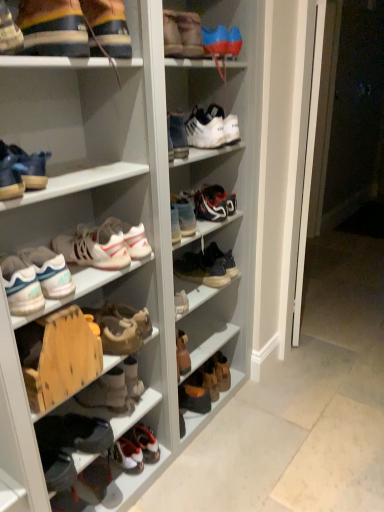
Question: Should I look upward or downward to see brown suede boots at center, which is the twelfth footwear in top-to-bottom order?

Choices:
 (A) down
 (B) up

Answer: (A)

Question: Is leather sneaker at center, the 10th footwear positioned from the top, taller than brown suede boots at center, which is the twelfth footwear in top-to-bottom order?

Choices:
 (A) no
 (B) yes

Answer: (A)

Question: Can you confirm if leather sneaker at center, the 5th footwear positioned from the bottom, is positioned to the left of brown suede boots at center, which is the twelfth footwear in top-to-bottom order?

Choices:
 (A) no
 (B) yes

Answer: (A)

Question: Can you confirm if leather sneaker at center, the 10th footwear positioned from the top, is smaller than brown suede boots at center, arranged as the third footwear when ordered from the bottom?

Choices:
 (A) yes
 (B) no

Answer: (A)

Question: Is leather sneaker at center, the 10th footwear positioned from the top, to the right of brown suede boots at center, arranged as the third footwear when ordered from the bottom, from the viewer's perspective?

Choices:
 (A) no
 (B) yes

Answer: (B)

Question: Is leather sneaker at center, the 5th footwear positioned from the bottom, facing away from brown suede boots at center, arranged as the third footwear when ordered from the bottom?

Choices:
 (A) yes
 (B) no

Answer: (B)

Question: Is leather sneaker at center, the 10th footwear positioned from the top, completely or partially outside of brown suede boots at center, which is the twelfth footwear in top-to-bottom order?

Choices:
 (A) yes
 (B) no

Answer: (A)

Question: From the image's perspective, does white matte sneakers at center, the 7th footwear in the top-to-bottom sequence, appear lower than white leather sneakers at center, which appears as the seventh footwear when ordered from the bottom?

Choices:
 (A) no
 (B) yes

Answer: (A)

Question: From the image's perspective, is white matte sneakers at center, which is the eighth footwear in bottom-to-top order, over white leather sneakers at center, which is counted as the 8th footwear, starting from the top?

Choices:
 (A) no
 (B) yes

Answer: (B)

Question: Considering the relative positions of white matte sneakers at center, the 7th footwear in the top-to-bottom sequence, and white leather sneakers at center, which is counted as the 8th footwear, starting from the top, in the image provided, is white matte sneakers at center, the 7th footwear in the top-to-bottom sequence, to the right of white leather sneakers at center, which is counted as the 8th footwear, starting from the top, from the viewer's perspective?

Choices:
 (A) yes
 (B) no

Answer: (A)

Question: Is white matte sneakers at center, which is the eighth footwear in bottom-to-top order, completely or partially outside of white leather sneakers at center, which appears as the seventh footwear when ordered from the bottom?

Choices:
 (A) no
 (B) yes

Answer: (B)

Question: Is white matte sneakers at center, the 7th footwear in the top-to-bottom sequence, shorter than white leather sneakers at center, which appears as the seventh footwear when ordered from the bottom?

Choices:
 (A) no
 (B) yes

Answer: (B)

Question: Can you confirm if white matte sneakers at center, which is the eighth footwear in bottom-to-top order, is thinner than white leather sneakers at center, which is counted as the 8th footwear, starting from the top?

Choices:
 (A) yes
 (B) no

Answer: (A)

Question: Does white matte sneakers at center, which is the eighth footwear in bottom-to-top order, have a lesser width compared to white matte sneaker at center, the third footwear from the top?

Choices:
 (A) yes
 (B) no

Answer: (A)